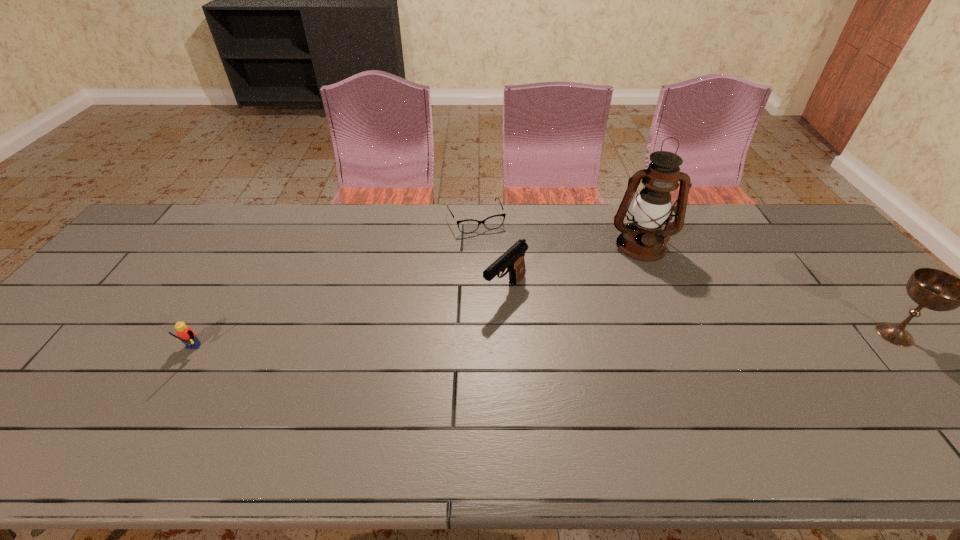
I want to click on free area in between the leftmost object and the chalice, so click(542, 344).

At what (x,y) coordinates should I click in order to perform the action: click on unoccupied area between the pistol and the fourth shortest object. Please return your answer as a coordinate pair (x, y). Looking at the image, I should click on (700, 312).

I want to click on free space between the third tallest object and the chalice, so click(x=700, y=312).

Locate an element on the screen. The image size is (960, 540). free spot between the chalice and the fourth tallest object is located at coordinates (542, 344).

I want to click on free point between the fourth tallest object and the lantern, so click(416, 300).

This screenshot has width=960, height=540. What are the coordinates of `free space between the fourth object from left to right and the Lego` in the screenshot? It's located at (416, 300).

Find the location of `free space between the chalice and the shortest object`. free space between the chalice and the shortest object is located at coordinates (685, 277).

Identify which object is located as the fourth nearest to the Lego. Please provide its 2D coordinates. Your answer should be formatted as a tuple, i.e. [(x, y)], where the tuple contains the x and y coordinates of a point satisfying the conditions above.

[(933, 289)]

Locate which object is the third closest to the second object from right to left. Please provide its 2D coordinates. Your answer should be formatted as a tuple, i.e. [(x, y)], where the tuple contains the x and y coordinates of a point satisfying the conditions above.

[(933, 289)]

Find the location of a particular element. The height and width of the screenshot is (540, 960). vacant area in the image that satisfies the following two spatial constraints: 1. on the front side of the rightmost object; 2. on the left side of the fourth object from left to right is located at coordinates (679, 334).